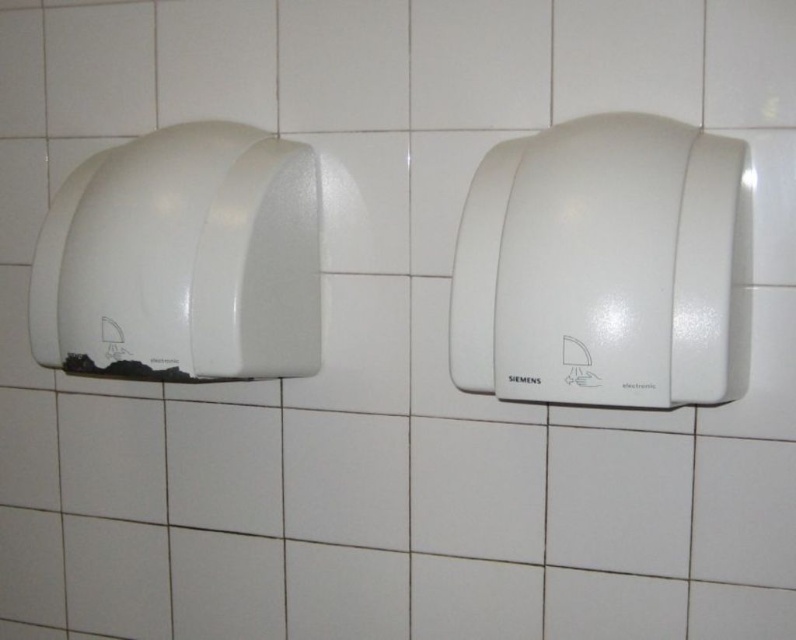
You are a maintenance worker checking the hand dryers in a restroom. You need to replace the filter of the white plastic hand dryer at center. Which dryer should you approach first if you are standing in front of the white matte hand dryer at left?

You should approach the white plastic hand dryer at center first because it is positioned on the right side of the white matte hand dryer at left, so it is directly to your right side when facing the white matte hand dryer at left.

Please provide the coordinates of the white plastic hand dryer at center in the image.

The white plastic hand dryer at center is located at coordinates point (605, 266).

You are a maintenance worker checking the hand dryers in a restroom. You need to replace the filter of the hand dryer located below another dryer. Which hand dryer should you choose between the white plastic hand dryer at center and the white matte hand dryer at left?

The white plastic hand dryer at center is below the white matte hand dryer at left, so you should choose the white plastic hand dryer at center to replace its filter.